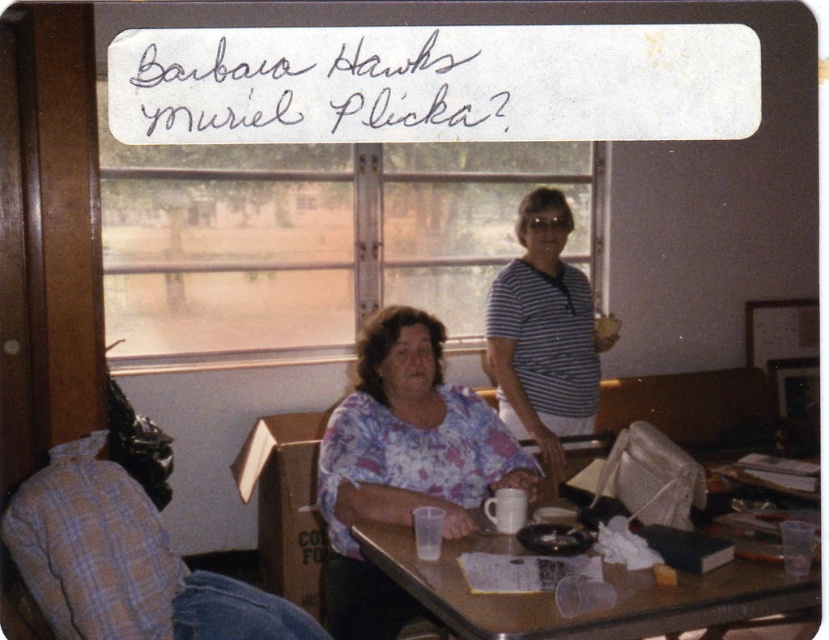
Question: Is floral fabric blouse at center to the right of matte plastic bag at upper center from the viewer's perspective?

Choices:
 (A) no
 (B) yes

Answer: (A)

Question: Where is floral fabric blouse at center located in relation to wooden table at center in the image?

Choices:
 (A) above
 (B) below

Answer: (A)

Question: Which object is farther from the camera taking this photo?

Choices:
 (A) matte plastic bag at upper center
 (B) striped cotton shirt at center
 (C) wooden table at center
 (D) floral fabric blouse at center

Answer: (A)

Question: In this image, where is striped cotton shirt at center located relative to matte plastic bag at upper center?

Choices:
 (A) above
 (B) below

Answer: (B)

Question: Which object is farther from the camera taking this photo?

Choices:
 (A) floral fabric blouse at center
 (B) wooden table at center
 (C) matte plastic bag at upper center
 (D) striped cotton shirt at center

Answer: (C)

Question: Which point appears farthest from the camera in this image?

Choices:
 (A) (582, 408)
 (B) (432, 428)
 (C) (594, 336)

Answer: (C)